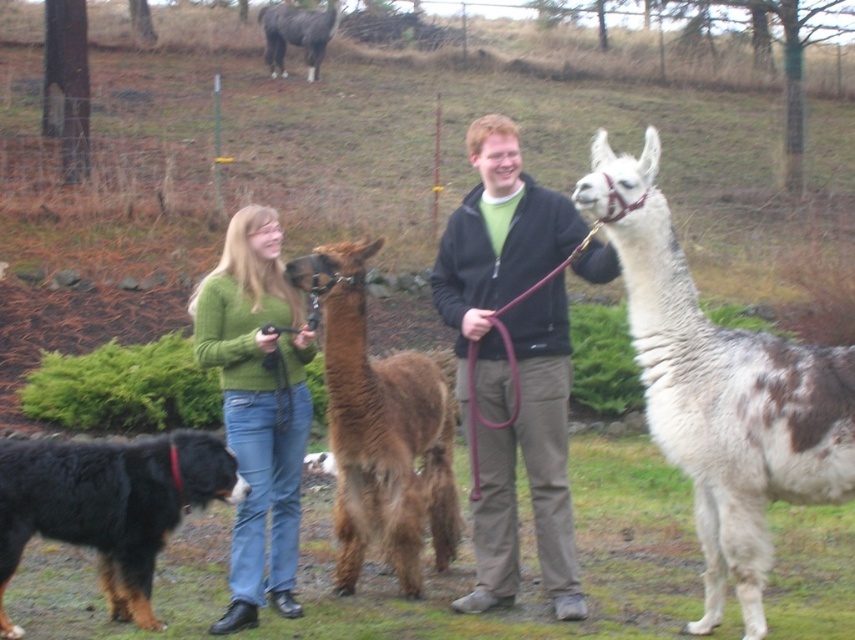
Is matte brown alpaca at center below dark brown leather jacket at center?

Yes.

Between point (568, 388) and point (535, 497), which one is positioned behind?

Positioned behind is point (535, 497).

Locate an element on the screen. matte brown alpaca at center is located at coordinates (506, 362).

Can you confirm if green sweater at center is thinner than black fur dog at lower left?

Yes, green sweater at center is thinner than black fur dog at lower left.

How much distance is there between green sweater at center and black fur dog at lower left?

green sweater at center is 21.08 inches away from black fur dog at lower left.

Identify the location of green sweater at center. Image resolution: width=855 pixels, height=640 pixels. point(258,404).

What do you see at coordinates (721, 392) in the screenshot? This screenshot has height=640, width=855. I see `white woolen alpaca at right` at bounding box center [721, 392].

Can you confirm if white woolen alpaca at right is positioned above dark brown leather jacket at center?

No.

Who is more forward, (776, 406) or (561, 413)?

Point (776, 406) is more forward.

Where is `white woolen alpaca at right`? Image resolution: width=855 pixels, height=640 pixels. white woolen alpaca at right is located at coordinates (721, 392).